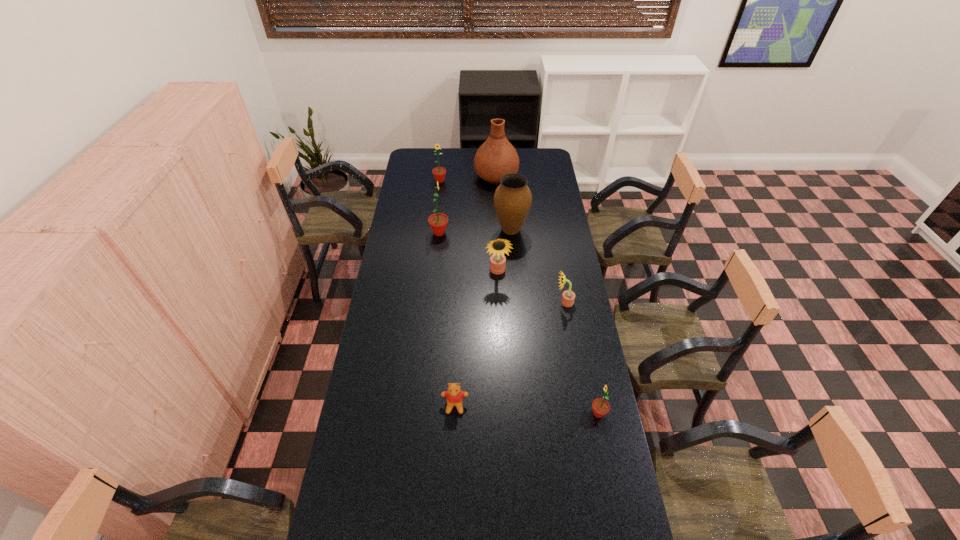
Identify the location of the nearest sunflower. This screenshot has width=960, height=540. (600, 406).

Identify the location of the nearest green sunflower. (600, 406).

Find the location of a particular element. red teddy bear is located at coordinates (454, 396).

Find the location of `the third object from left to right`. the third object from left to right is located at coordinates tap(454, 396).

I want to click on blank space located 0.130m on the side of the pitcher with the handle, so click(x=495, y=151).

Identify the location of vacant space located 0.050m on the side of the pitcher with the handle. (495, 158).

I want to click on blank space located 0.060m on the side of the pitcher with the handle, so click(495, 157).

I want to click on vacant space located on the face of the second farthest sunflower, so click(516, 233).

Locate an element on the screen. vacant point located on the left of the urn is located at coordinates (433, 230).

Identify the location of vacant region located on the face of the farthest green sunflower. (436, 221).